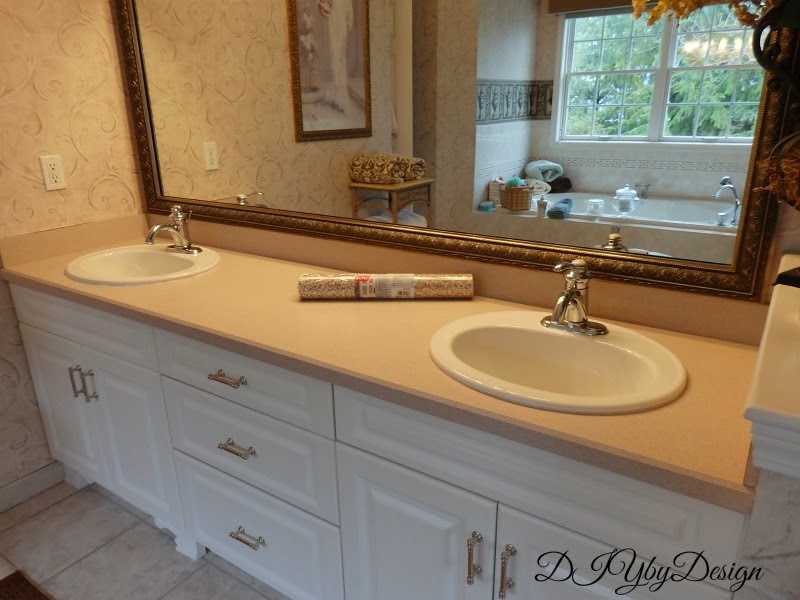
Identify the location of towels. The width and height of the screenshot is (800, 600). (545, 169), (561, 185).